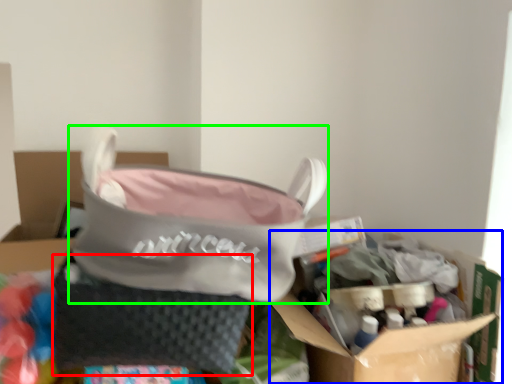
Question: Considering the real-world distances, which object is closest to pouch (highlighted by a red box)? cardboard box (highlighted by a blue box) or handbag (highlighted by a green box).

Choices:
 (A) cardboard box
 (B) handbag

Answer: (B)